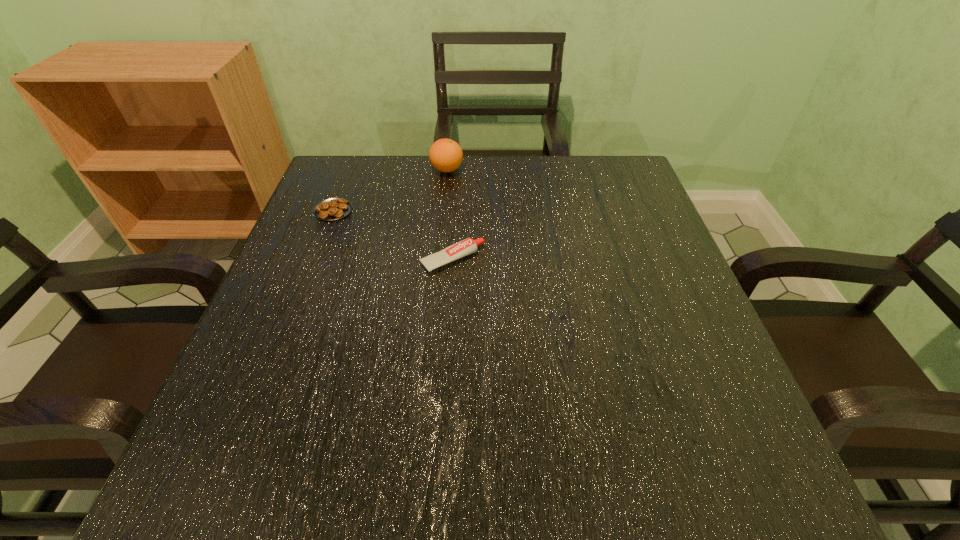
Find the location of a particular element. This screenshot has width=960, height=540. the farthest object is located at coordinates (446, 155).

This screenshot has height=540, width=960. Find the location of `the tallest object`. the tallest object is located at coordinates [446, 155].

Locate an element on the screen. The height and width of the screenshot is (540, 960). the second tallest object is located at coordinates (468, 246).

At what (x,y) coordinates should I click in order to perform the action: click on the nearest object. Please return your answer as a coordinate pair (x, y). The image size is (960, 540). Looking at the image, I should click on (468, 246).

Where is `pastry`? The image size is (960, 540). pastry is located at coordinates (332, 209).

Find the location of a particular element. The width and height of the screenshot is (960, 540). the shortest object is located at coordinates (332, 209).

The image size is (960, 540). Find the location of `vacant area situated 0.310m on the right of the orange`. vacant area situated 0.310m on the right of the orange is located at coordinates point(582,170).

Locate an element on the screen. The height and width of the screenshot is (540, 960). free spot located 0.200m on the front of the nearest object is located at coordinates coord(445,361).

At what (x,y) coordinates should I click in order to perform the action: click on vacant space situated on the right of the second nearest object. Please return your answer as a coordinate pair (x, y). The image size is (960, 540). Looking at the image, I should click on (493, 211).

You are a GUI agent. You are given a task and a screenshot of the screen. Output one action in this format:
    pyautogui.click(x=<x>, y=<y>)
    Task: Click on the orange situated at the far edge
    
    Given the screenshot: What is the action you would take?
    pyautogui.click(x=446, y=155)